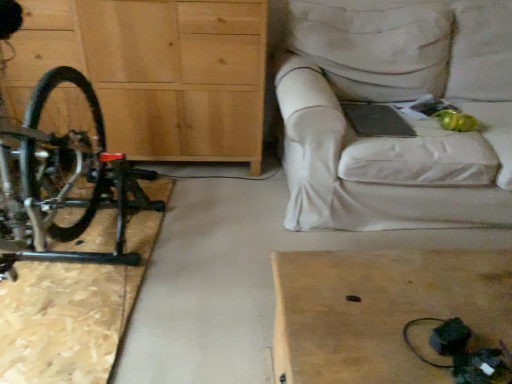
Question: Is light brown wooden table at lower right at the left side of black matte bicycle at left?

Choices:
 (A) yes
 (B) no

Answer: (B)

Question: Could you tell me if light brown wooden table at lower right is turned towards black matte bicycle at left?

Choices:
 (A) no
 (B) yes

Answer: (A)

Question: Is light brown wooden table at lower right shorter than black matte bicycle at left?

Choices:
 (A) yes
 (B) no

Answer: (A)

Question: Considering the relative sizes of light brown wooden table at lower right and black matte bicycle at left in the image provided, is light brown wooden table at lower right smaller than black matte bicycle at left?

Choices:
 (A) yes
 (B) no

Answer: (A)

Question: Is black matte bicycle at left completely or partially inside light brown wooden table at lower right?

Choices:
 (A) yes
 (B) no

Answer: (B)

Question: Is point (335, 261) closer or farther from the camera than point (23, 168)?

Choices:
 (A) closer
 (B) farther

Answer: (A)

Question: From a real-world perspective, relative to black matte bicycle at left, is light brown wooden table at lower right vertically above or below?

Choices:
 (A) above
 (B) below

Answer: (B)

Question: Do you think light brown wooden table at lower right is within black matte bicycle at left, or outside of it?

Choices:
 (A) inside
 (B) outside

Answer: (B)

Question: In terms of height, does light brown wooden table at lower right look taller or shorter compared to black matte bicycle at left?

Choices:
 (A) short
 (B) tall

Answer: (A)

Question: From the image's perspective, is wooden chest of drawers at left positioned above or below black matte bicycle at left?

Choices:
 (A) above
 (B) below

Answer: (A)

Question: Is wooden chest of drawers at left to the left or to the right of black matte bicycle at left in the image?

Choices:
 (A) right
 (B) left

Answer: (A)

Question: Considering the positions of wooden chest of drawers at left and black matte bicycle at left in the image, is wooden chest of drawers at left wider or thinner than black matte bicycle at left?

Choices:
 (A) thin
 (B) wide

Answer: (A)

Question: Which is correct: wooden chest of drawers at left is inside black matte bicycle at left, or outside of it?

Choices:
 (A) outside
 (B) inside

Answer: (A)

Question: Is point (99, 4) closer or farther from the camera than point (296, 74)?

Choices:
 (A) closer
 (B) farther

Answer: (B)

Question: From the image's perspective, is wooden chest of drawers at left above or below white fabric couch at upper right?

Choices:
 (A) above
 (B) below

Answer: (A)